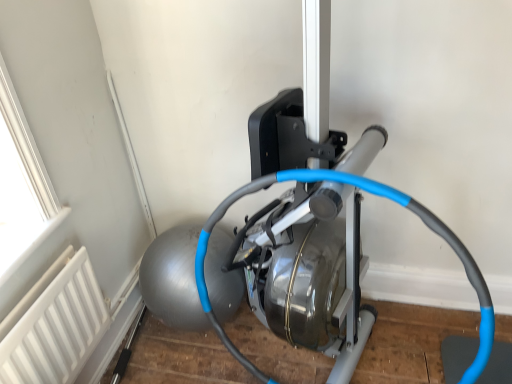
What do you see at coordinates (373, 194) in the screenshot? Image resolution: width=512 pixels, height=384 pixels. I see `blue rubber hose at center` at bounding box center [373, 194].

In order to click on blue rubber hose at center in this screenshot , I will do `click(373, 194)`.

The width and height of the screenshot is (512, 384). Identify the location of white matte radiator at lower left. (57, 329).

The width and height of the screenshot is (512, 384). What do you see at coordinates (57, 329) in the screenshot?
I see `white matte radiator at lower left` at bounding box center [57, 329].

Where is `blue rubber hose at center`? blue rubber hose at center is located at coordinates (373, 194).

Does white matte radiator at lower left appear on the left side of blue rubber hose at center?

Yes, white matte radiator at lower left is to the left of blue rubber hose at center.

Which is behind, white matte radiator at lower left or blue rubber hose at center?

Positioned behind is white matte radiator at lower left.

Between point (73, 329) and point (228, 203), which one is positioned behind?

The point (228, 203) is more distant.

From the image's perspective, who appears lower, white matte radiator at lower left or blue rubber hose at center?

white matte radiator at lower left.

From a real-world perspective, is white matte radiator at lower left below blue rubber hose at center?

Yes, from a real-world perspective, white matte radiator at lower left is below blue rubber hose at center.

Is white matte radiator at lower left wider or thinner than blue rubber hose at center?

Clearly, white matte radiator at lower left has less width compared to blue rubber hose at center.

Can you confirm if white matte radiator at lower left is shorter than blue rubber hose at center?

Yes, white matte radiator at lower left is shorter than blue rubber hose at center.

Can you confirm if white matte radiator at lower left is smaller than blue rubber hose at center?

Indeed, white matte radiator at lower left has a smaller size compared to blue rubber hose at center.

Can blue rubber hose at center be found inside white matte radiator at lower left?

That's incorrect, blue rubber hose at center is not inside white matte radiator at lower left.

Is there a large distance between white matte radiator at lower left and blue rubber hose at center?

No, there isn't a large distance between white matte radiator at lower left and blue rubber hose at center.

Could you tell me if white matte radiator at lower left is turned towards blue rubber hose at center?

Yes, white matte radiator at lower left faces towards blue rubber hose at center.

How many degrees apart are the facing directions of white matte radiator at lower left and blue rubber hose at center?

There is a 99.1-degree angle between the facing directions of white matte radiator at lower left and blue rubber hose at center.

Find the location of a particular element. The width and height of the screenshot is (512, 384). radiator lying below the blue rubber hose at center (from the image's perspective) is located at coordinates (57, 329).

In the image, is blue rubber hose at center on the left side or the right side of white matte radiator at lower left?

Based on their positions, blue rubber hose at center is located to the right of white matte radiator at lower left.

Is blue rubber hose at center in front of or behind white matte radiator at lower left in the image?

blue rubber hose at center is positioned closer to the viewer than white matte radiator at lower left.

Considering the positions of point (446, 228) and point (81, 356), is point (446, 228) closer or farther from the camera than point (81, 356)?

Point (446, 228) is closer to the camera than point (81, 356).

From the image's perspective, would you say blue rubber hose at center is shown under white matte radiator at lower left?

No, from the image's perspective, blue rubber hose at center is not below white matte radiator at lower left.

From a real-world perspective, who is located higher, blue rubber hose at center or white matte radiator at lower left?

blue rubber hose at center is physically above.

Consider the image. Which object is thinner, blue rubber hose at center or white matte radiator at lower left?

white matte radiator at lower left is thinner.

Considering the sizes of objects blue rubber hose at center and white matte radiator at lower left in the image provided, who is shorter, blue rubber hose at center or white matte radiator at lower left?

With less height is white matte radiator at lower left.

Considering the relative sizes of blue rubber hose at center and white matte radiator at lower left in the image provided, is blue rubber hose at center smaller than white matte radiator at lower left?

Actually, blue rubber hose at center might be larger than white matte radiator at lower left.

Choose the correct answer: Is blue rubber hose at center inside white matte radiator at lower left or outside it?

blue rubber hose at center is located beyond the bounds of white matte radiator at lower left.

Is blue rubber hose at center far away from white matte radiator at lower left?

Actually, blue rubber hose at center and white matte radiator at lower left are a little close together.

Is blue rubber hose at center oriented away from white matte radiator at lower left?

No, blue rubber hose at center is not facing the opposite direction of white matte radiator at lower left.

Can you tell me how much blue rubber hose at center and white matte radiator at lower left differ in facing direction?

The facing directions of blue rubber hose at center and white matte radiator at lower left are 99.1 degrees apart.

Measure the distance from blue rubber hose at center to white matte radiator at lower left.

A distance of 22.15 inches exists between blue rubber hose at center and white matte radiator at lower left.

Image resolution: width=512 pixels, height=384 pixels. In order to click on wire in front of the white matte radiator at lower left in this screenshot , I will do `click(373, 194)`.

Where is `wire above the white matte radiator at lower left (from the image's perspective)`? The height and width of the screenshot is (384, 512). wire above the white matte radiator at lower left (from the image's perspective) is located at coordinates (373, 194).

Image resolution: width=512 pixels, height=384 pixels. Identify the location of radiator that appears on the left of blue rubber hose at center. (57, 329).